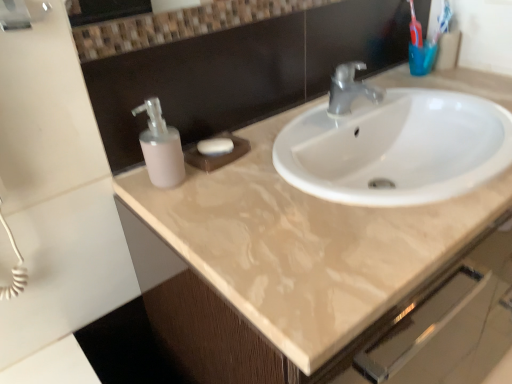
The width and height of the screenshot is (512, 384). Identify the location of matte plastic soap dispenser at left. (161, 147).

Describe the element at coordinates (443, 21) in the screenshot. I see `blue plastic toothbrush at upper right` at that location.

In order to click on white matte soap at center in this screenshot , I will do `click(215, 146)`.

At what (x,y) coordinates should I click in order to perform the action: click on beige glossy sink at upper center. Please return your answer as a coordinate pair (x, y). The height and width of the screenshot is (384, 512). Looking at the image, I should click on (353, 337).

Which of these two, matte plastic soap dispenser at left or beige glossy sink at upper center, is smaller?

matte plastic soap dispenser at left is smaller.

Is matte plastic soap dispenser at left inside or outside of beige glossy sink at upper center?

matte plastic soap dispenser at left is located beyond the bounds of beige glossy sink at upper center.

From the image's perspective, between matte plastic soap dispenser at left and beige glossy sink at upper center, which one is located above?

matte plastic soap dispenser at left, from the image's perspective.

Consider the image. Measure the distance from matte plastic soap dispenser at left to beige glossy sink at upper center.

matte plastic soap dispenser at left is 16.63 inches away from beige glossy sink at upper center.

From a real-world perspective, between matte plastic soap dispenser at left and white matte soap at center, who is vertically lower?

white matte soap at center, from a real-world perspective.

Which is farther, (x=146, y=145) or (x=211, y=145)?

The point (x=211, y=145) is farther from the camera.

Identify the location of soap on the right of matte plastic soap dispenser at left. The image size is (512, 384). (215, 146).

Is matte plastic soap dispenser at left taller or shorter than white matte soap at center?

In the image, matte plastic soap dispenser at left appears to be taller than white matte soap at center.

Based on the photo, does white matte soap at center appear on the right side of beige glossy sink at upper center?

No, white matte soap at center is not to the right of beige glossy sink at upper center.

Considering the positions of points (217, 142) and (376, 361), is point (217, 142) farther from camera compared to point (376, 361)?

Yes, point (217, 142) is farther from viewer.

From a real-world perspective, is white matte soap at center positioned over beige glossy sink at upper center based on gravity?

Indeed, from a real-world perspective, white matte soap at center stands above beige glossy sink at upper center.

From the image's perspective, does white matte soap at center appear lower than beige glossy sink at upper center?

No.

Is matte plastic soap dispenser at left completely or partially inside beige glossy sink at upper center?

Definitely not — matte plastic soap dispenser at left is not inside beige glossy sink at upper center.

I want to click on bathroom cabinet below the matte plastic soap dispenser at left (from the image's perspective), so click(x=353, y=337).

From their relative heights in the image, would you say beige glossy sink at upper center is taller or shorter than matte plastic soap dispenser at left?

Clearly, beige glossy sink at upper center is taller compared to matte plastic soap dispenser at left.

Can you tell me how much beige glossy sink at upper center and matte plastic soap dispenser at left differ in facing direction?

beige glossy sink at upper center and matte plastic soap dispenser at left are facing 1.74 degrees away from each other.

Is blue plastic toothbrush at upper right far from matte plastic soap dispenser at left?

They are positioned close to each other.

Locate an element on the screen. This screenshot has height=384, width=512. toothbrush on the right of matte plastic soap dispenser at left is located at coordinates (443, 21).

Considering the relative sizes of blue plastic toothbrush at upper right and matte plastic soap dispenser at left in the image provided, is blue plastic toothbrush at upper right thinner than matte plastic soap dispenser at left?

Yes.

Between blue plastic toothbrush at upper right and matte plastic soap dispenser at left, which one has less height?

blue plastic toothbrush at upper right is shorter.

Would you consider blue plastic toothbrush at upper right to be distant from white matte soap at center?

No, blue plastic toothbrush at upper right is not far from white matte soap at center.

From the image's perspective, is blue plastic toothbrush at upper right under white matte soap at center?

Incorrect, from the image's perspective, blue plastic toothbrush at upper right is higher than white matte soap at center.

Which is correct: blue plastic toothbrush at upper right is inside white matte soap at center, or outside of it?

blue plastic toothbrush at upper right exists outside the volume of white matte soap at center.

Does blue plastic toothbrush at upper right have a greater width compared to white matte soap at center?

Incorrect, the width of blue plastic toothbrush at upper right does not surpass that of white matte soap at center.

Are white matte soap at center and matte plastic soap dispenser at left beside each other?

white matte soap at center is not next to matte plastic soap dispenser at left, and they're not touching.

From a real-world perspective, is white matte soap at center under matte plastic soap dispenser at left?

Yes.

Can you tell me how much white matte soap at center and matte plastic soap dispenser at left differ in facing direction?

26.3 degrees separate the facing orientations of white matte soap at center and matte plastic soap dispenser at left.

In the scene shown: Considering their positions, is white matte soap at center located in front of or behind matte plastic soap dispenser at left?

Clearly, white matte soap at center is behind matte plastic soap dispenser at left.

Where is `soap dispenser lying above the beige glossy sink at upper center (from the image's perspective)`? Image resolution: width=512 pixels, height=384 pixels. soap dispenser lying above the beige glossy sink at upper center (from the image's perspective) is located at coordinates pos(161,147).

Identify the location of soap below the matte plastic soap dispenser at left (from a real-world perspective). (215, 146).

When comparing their distances from blue plastic toothbrush at upper right, does matte plastic soap dispenser at left or white matte soap at center seem closer?

The object closer to blue plastic toothbrush at upper right is white matte soap at center.

Based on their spatial positions, is beige glossy sink at upper center or blue plastic toothbrush at upper right closer to white matte soap at center?

Among the two, beige glossy sink at upper center is located nearer to white matte soap at center.

From the image, which object appears to be farther from matte plastic soap dispenser at left, white matte soap at center or blue plastic toothbrush at upper right?

blue plastic toothbrush at upper right is positioned further to the anchor matte plastic soap dispenser at left.

From the image, which object appears to be nearer to white matte soap at center, beige glossy sink at upper center or matte plastic soap dispenser at left?

matte plastic soap dispenser at left lies closer to white matte soap at center than the other object.

Considering their positions, is matte plastic soap dispenser at left positioned further to beige glossy sink at upper center than blue plastic toothbrush at upper right?

The object further to beige glossy sink at upper center is blue plastic toothbrush at upper right.

Considering their positions, is matte plastic soap dispenser at left positioned further to white matte soap at center than beige glossy sink at upper center?

The object further to white matte soap at center is beige glossy sink at upper center.

Looking at the image, which one is located closer to beige glossy sink at upper center, white matte soap at center or blue plastic toothbrush at upper right?

white matte soap at center is closer to beige glossy sink at upper center.

When comparing their distances from matte plastic soap dispenser at left, does beige glossy sink at upper center or white matte soap at center seem further?

beige glossy sink at upper center.

Find the location of a particular element. The image size is (512, 384). soap dispenser between blue plastic toothbrush at upper right and beige glossy sink at upper center in the vertical direction is located at coordinates (161, 147).

Identify the location of soap between blue plastic toothbrush at upper right and beige glossy sink at upper center from top to bottom. This screenshot has width=512, height=384. [x=215, y=146].

The width and height of the screenshot is (512, 384). What are the coordinates of `soap located between matte plastic soap dispenser at left and beige glossy sink at upper center in the left-right direction` in the screenshot? It's located at [x=215, y=146].

Identify the location of soap between matte plastic soap dispenser at left and blue plastic toothbrush at upper right in the horizontal direction. This screenshot has width=512, height=384. (215, 146).